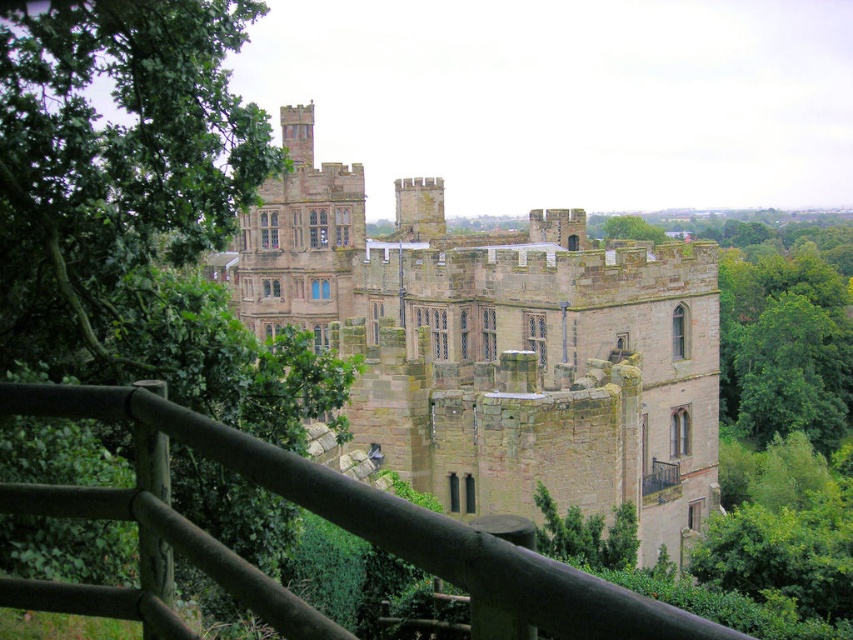
You are standing on a viewing platform with a wooden railing and want to take a photo of the brown stone castle at center and the green leafy tree at left. Which object will appear closer to you in the photo?

The brown stone castle at center will appear closer to you in the photo because it is positioned further to the viewer than the green leafy tree at left.

You are standing at the point marked by the coordinate point (494, 342) in the image. What structure are you facing?

The point (494, 342) indicates the brown stone castle at center, so you are facing the brown stone castle at center.

You are standing on a viewing platform with a wooden railing and want to take a photo of the brown stone castle at center. However, the green leafy tree at left is blocking your view. Can you move to the right to get an unobstructed view of the castle?

The brown stone castle at center is positioned under the green leafy tree at left, so moving to the right would allow you to avoid the tree and get an unobstructed view of the castle.